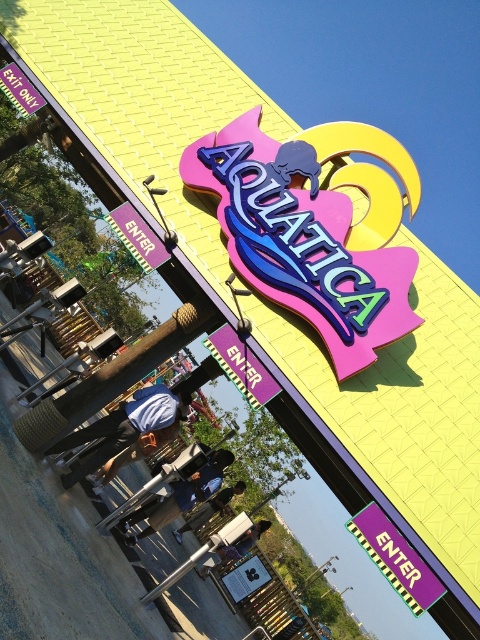
You are standing at the entrance of Aquatica and see the glossy plastic aquatica sign at center and the purple glossy sign at center. Which one is positioned to the left?

The glossy plastic aquatica sign at center is positioned to the left of the purple glossy sign at center.

You are standing at the entrance of Aquatica water park and see the glossy plastic aquatica sign at center and the purple glossy sign at center. Which one is closer to you?

The glossy plastic aquatica sign at center is closer to you because it is further to the viewer than the purple glossy sign at center.